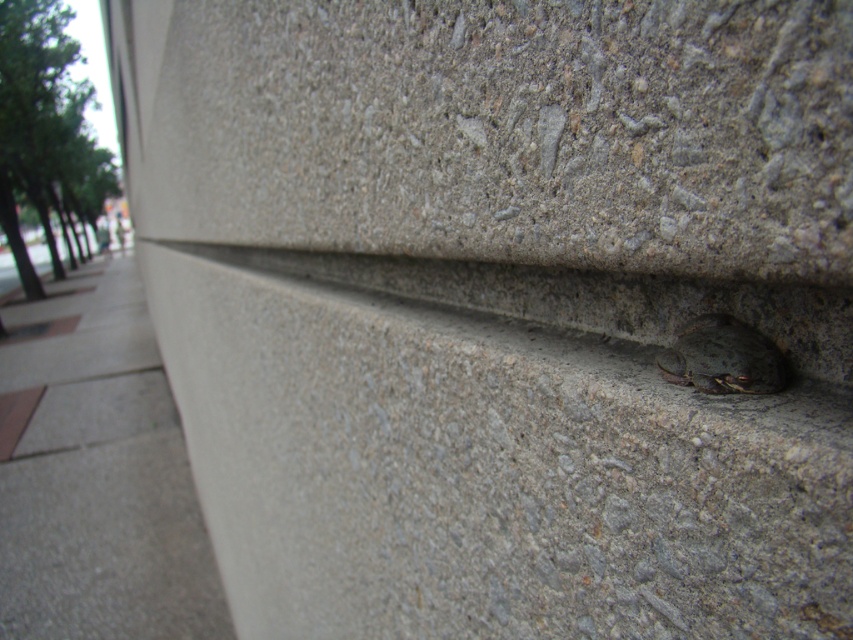
You are standing in a garden and see the gray concrete wall at lower right and the gray concrete pavement at lower left. Which object is closer to you?

The gray concrete wall at lower right is closer to you because it is in front of the gray concrete pavement at lower left.

You are a construction worker needing to place a 5 meter long steel beam between the gray concrete wall at lower right and the gray concrete pavement at lower left. Based on the scene, will the beam fit between them?

The distance between the gray concrete wall at lower right and the gray concrete pavement at lower left is 4.46 meters. Since the beam is 5 meters long, it will not fit as it is longer than the available space.